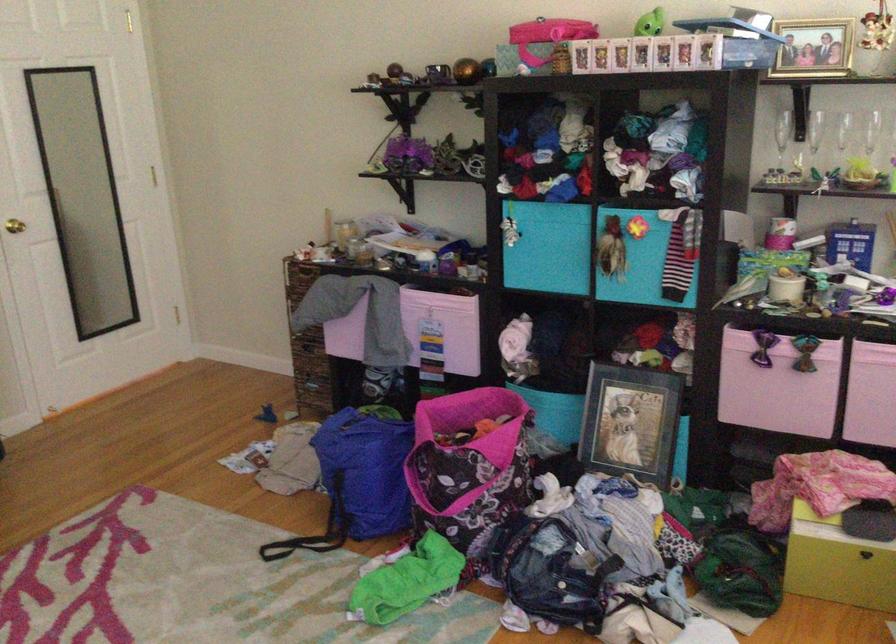
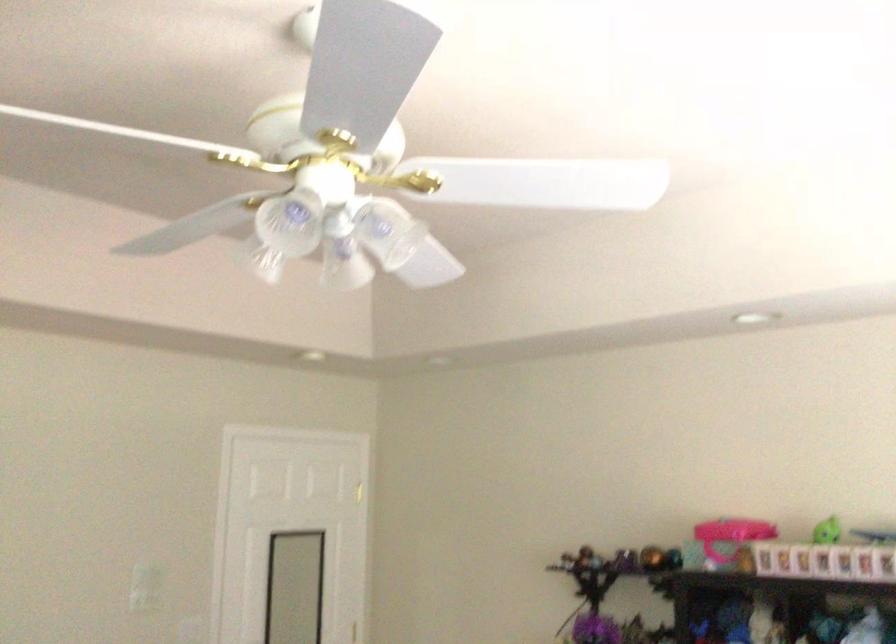
Question: Based on the continuous images, in which direction is the camera rotating? Reply with the corresponding letter.

Choices:
 (A) Left
 (B) Right
 (C) Up
 (D) Down

Answer: (C)